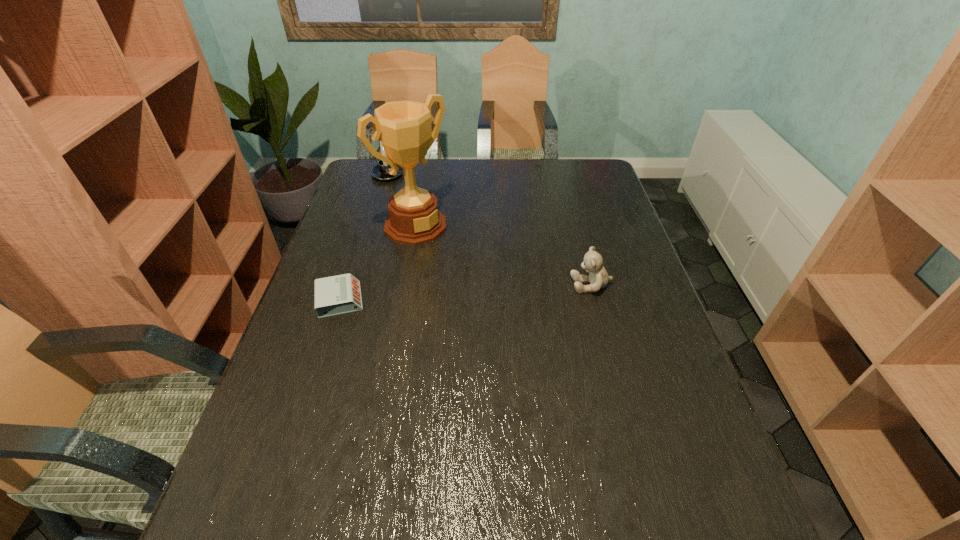
Locate an element on the screen. award at the left edge is located at coordinates (404, 127).

Locate an element on the screen. object at the right edge is located at coordinates (598, 278).

This screenshot has height=540, width=960. I want to click on object that is positioned at the far left corner, so click(380, 172).

Find the location of a particular element. The image size is (960, 540). vacant space at the far edge is located at coordinates (435, 164).

Where is `vacant space at the near edge`? This screenshot has height=540, width=960. vacant space at the near edge is located at coordinates [x=610, y=449].

This screenshot has height=540, width=960. What are the coordinates of `blank space at the left edge` in the screenshot? It's located at (320, 395).

Find the location of a particular element. vacant space at the right edge of the desktop is located at coordinates (592, 204).

The image size is (960, 540). Find the location of `free spot at the near left corner of the desktop`. free spot at the near left corner of the desktop is located at coordinates (293, 487).

Where is `empty space between the shortest object and the tallest object`? This screenshot has height=540, width=960. empty space between the shortest object and the tallest object is located at coordinates (378, 263).

Find the location of a particular element. This screenshot has height=540, width=960. vacant area that lies between the candle holder and the shortest object is located at coordinates (364, 237).